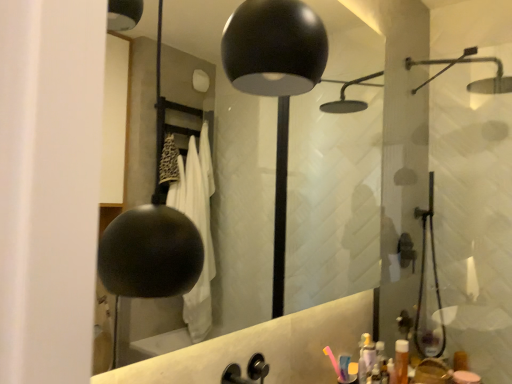
Identify the location of translucent orange bottle at lower right. This screenshot has width=512, height=384. (401, 361).

Locate an element on the screen. The image size is (512, 384). pink plastic toothbrush at lower right is located at coordinates (333, 362).

Locate an element on the screen. The width and height of the screenshot is (512, 384). black matte faucet at center is located at coordinates (247, 371).

I want to click on translucent orange bottle at lower right, so click(x=401, y=361).

Is translucent orange bottle at lower right at the back of black matte mirror at upper center?

No, black matte mirror at upper center's orientation is not away from translucent orange bottle at lower right.

Looking at this image, from a real-world perspective, who is located lower, black matte mirror at upper center or translucent orange bottle at lower right?

translucent orange bottle at lower right.

Can translucent orange bottle at lower right be found inside black matte mirror at upper center?

Actually, translucent orange bottle at lower right is outside black matte mirror at upper center.

Where is `mirror above the translucent orange bottle at lower right (from a real-world perspective)`? mirror above the translucent orange bottle at lower right (from a real-world perspective) is located at coordinates (241, 353).

Based on their positions, is pink plastic toothbrush at lower right located to the left or right of black matte faucet at center?

Based on their positions, pink plastic toothbrush at lower right is located to the right of black matte faucet at center.

You are a GUI agent. You are given a task and a screenshot of the screen. Output one action in this format:
    pyautogui.click(x=<x>, y=<y>)
    Task: Click on the faucet to the left of pink plastic toothbrush at lower right
    
    Given the screenshot: What is the action you would take?
    pyautogui.click(x=247, y=371)

Considering the relative positions of pink plastic toothbrush at lower right and black matte faucet at center in the image provided, is pink plastic toothbrush at lower right in front of black matte faucet at center?

No, pink plastic toothbrush at lower right is further to the viewer.

From the image's perspective, between pink plastic toothbrush at lower right and black matte faucet at center, which one is located above?

black matte faucet at center, from the image's perspective.

Consider the image. Does black matte mirror at upper center turn towards pink plastic toothbrush at lower right?

No, black matte mirror at upper center is not facing towards pink plastic toothbrush at lower right.

How many degrees apart are the facing directions of black matte mirror at upper center and pink plastic toothbrush at lower right?

2.84 degrees.

Where is `toothbrush that is below the black matte mirror at upper center (from the image's perspective)`? toothbrush that is below the black matte mirror at upper center (from the image's perspective) is located at coordinates (333, 362).

Is black matte mirror at upper center further to the viewer compared to pink plastic toothbrush at lower right?

That is False.

From the image's perspective, is pink plastic toothbrush at lower right on translucent orange bottle at lower right?

Yes, from the image's perspective, pink plastic toothbrush at lower right is over translucent orange bottle at lower right.

Can you confirm if pink plastic toothbrush at lower right is positioned to the right of translucent orange bottle at lower right?

No, pink plastic toothbrush at lower right is not to the right of translucent orange bottle at lower right.

Can you tell me how much pink plastic toothbrush at lower right and translucent orange bottle at lower right differ in facing direction?

0.00335 degrees separate the facing orientations of pink plastic toothbrush at lower right and translucent orange bottle at lower right.

In the scene shown: Is pink plastic toothbrush at lower right not within black matte mirror at upper center?

That's correct, pink plastic toothbrush at lower right is outside of black matte mirror at upper center.

Is pink plastic toothbrush at lower right positioned with its back to black matte mirror at upper center?

pink plastic toothbrush at lower right does not have its back to black matte mirror at upper center.

Based on their positions, is pink plastic toothbrush at lower right located to the left or right of black matte mirror at upper center?

pink plastic toothbrush at lower right is positioned on black matte mirror at upper center's right side.

Identify the location of toothbrush below the black matte faucet at center (from a real-world perspective). This screenshot has height=384, width=512. (333, 362).

Does black matte faucet at center turn towards pink plastic toothbrush at lower right?

No, black matte faucet at center is not aimed at pink plastic toothbrush at lower right.

From a real-world perspective, who is located higher, black matte faucet at center or pink plastic toothbrush at lower right?

black matte faucet at center.

From the picture: Considering the sizes of black matte faucet at center and pink plastic toothbrush at lower right in the image, is black matte faucet at center wider or thinner than pink plastic toothbrush at lower right?

In the image, black matte faucet at center appears to be wider than pink plastic toothbrush at lower right.

Which object is closer to the camera taking this photo, black matte mirror at upper center or black matte faucet at center?

black matte mirror at upper center is more forward.

Is black matte faucet at center completely or partially inside black matte mirror at upper center?

No, black matte mirror at upper center does not contain black matte faucet at center.

From a real-world perspective, is black matte mirror at upper center located beneath black matte faucet at center?

Incorrect, from a real-world perspective, black matte mirror at upper center is higher than black matte faucet at center.

Image resolution: width=512 pixels, height=384 pixels. Find the location of `mirror to the left of translucent orange bottle at lower right`. mirror to the left of translucent orange bottle at lower right is located at coordinates (241, 353).

Locate an element on the screen. This screenshot has width=512, height=384. toothbrush on the right of black matte faucet at center is located at coordinates (333, 362).

Based on their spatial positions, is black matte mirror at upper center or translucent orange bottle at lower right closer to pink plastic toothbrush at lower right?

translucent orange bottle at lower right lies closer to pink plastic toothbrush at lower right than the other object.

Based on their spatial positions, is translucent orange bottle at lower right or pink plastic toothbrush at lower right further from black matte faucet at center?

translucent orange bottle at lower right lies further to black matte faucet at center than the other object.

Based on their spatial positions, is pink plastic toothbrush at lower right or black matte mirror at upper center further from translucent orange bottle at lower right?

black matte mirror at upper center is positioned further to the anchor translucent orange bottle at lower right.

When comparing their distances from pink plastic toothbrush at lower right, does translucent orange bottle at lower right or black matte faucet at center seem closer?

Among the two, black matte faucet at center is located nearer to pink plastic toothbrush at lower right.

From the image, which object appears to be nearer to black matte mirror at upper center, black matte faucet at center or translucent orange bottle at lower right?

translucent orange bottle at lower right lies closer to black matte mirror at upper center than the other object.

Considering their positions, is translucent orange bottle at lower right positioned further to black matte mirror at upper center than pink plastic toothbrush at lower right?

pink plastic toothbrush at lower right is further to black matte mirror at upper center.

When comparing their distances from pink plastic toothbrush at lower right, does translucent orange bottle at lower right or black matte mirror at upper center seem further?

black matte mirror at upper center.

Which object lies further to the anchor point translucent orange bottle at lower right, black matte mirror at upper center or pink plastic toothbrush at lower right?

Based on the image, black matte mirror at upper center appears to be further to translucent orange bottle at lower right.

Locate an element on the screen. faucet between black matte mirror at upper center and translucent orange bottle at lower right from front to back is located at coordinates (247, 371).

The image size is (512, 384). In order to click on toothbrush located between black matte mirror at upper center and translucent orange bottle at lower right in the depth direction in this screenshot , I will do `click(333, 362)`.

I want to click on toothbrush between black matte faucet at center and translucent orange bottle at lower right from front to back, so click(333, 362).

Where is `faucet positioned between black matte mirror at upper center and pink plastic toothbrush at lower right from near to far`? The width and height of the screenshot is (512, 384). faucet positioned between black matte mirror at upper center and pink plastic toothbrush at lower right from near to far is located at coordinates (247, 371).